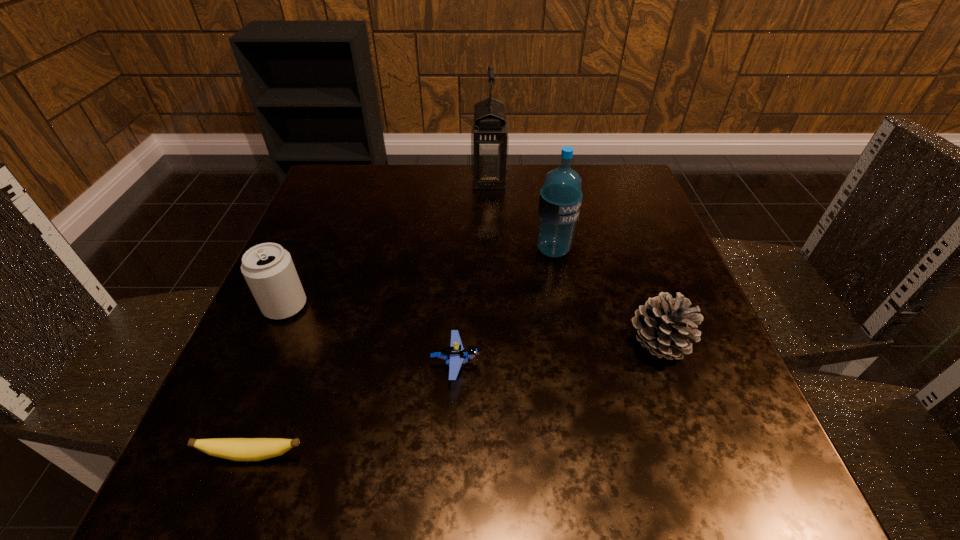
I want to click on vacant space located on the front-facing side of the lantern, so click(x=417, y=179).

Identify the location of vacant space located 0.370m on the front-facing side of the lantern. This screenshot has height=540, width=960. (325, 179).

This screenshot has width=960, height=540. Identify the location of vacant space situated on the right of the second object from right to left. (601, 250).

Where is `free space located 0.170m on the right of the can`? The height and width of the screenshot is (540, 960). free space located 0.170m on the right of the can is located at coordinates (400, 306).

You are a GUI agent. You are given a task and a screenshot of the screen. Output one action in this format:
    pyautogui.click(x=<x>, y=<y>)
    Task: Click on the vacant space located 0.100m on the left of the pinecone
    This screenshot has height=540, width=960.
    Given the screenshot: What is the action you would take?
    pyautogui.click(x=567, y=344)

You are a GUI agent. You are given a task and a screenshot of the screen. Output one action in this format:
    pyautogui.click(x=<x>, y=<y>)
    Task: Click on the vacant space located 0.340m on the front-facing side of the fifth tallest object
    This screenshot has height=540, width=960.
    Given the screenshot: What is the action you would take?
    pyautogui.click(x=689, y=364)

Locate an element on the screen. The width and height of the screenshot is (960, 540). vacant space situated on the right of the banana is located at coordinates pos(561,455).

Locate an element on the screen. The width and height of the screenshot is (960, 540). object located at the far edge is located at coordinates (489, 136).

Locate an element on the screen. The height and width of the screenshot is (540, 960). object that is at the near edge is located at coordinates (237, 449).

In order to click on can positioned at the left edge in this screenshot , I will do `click(268, 269)`.